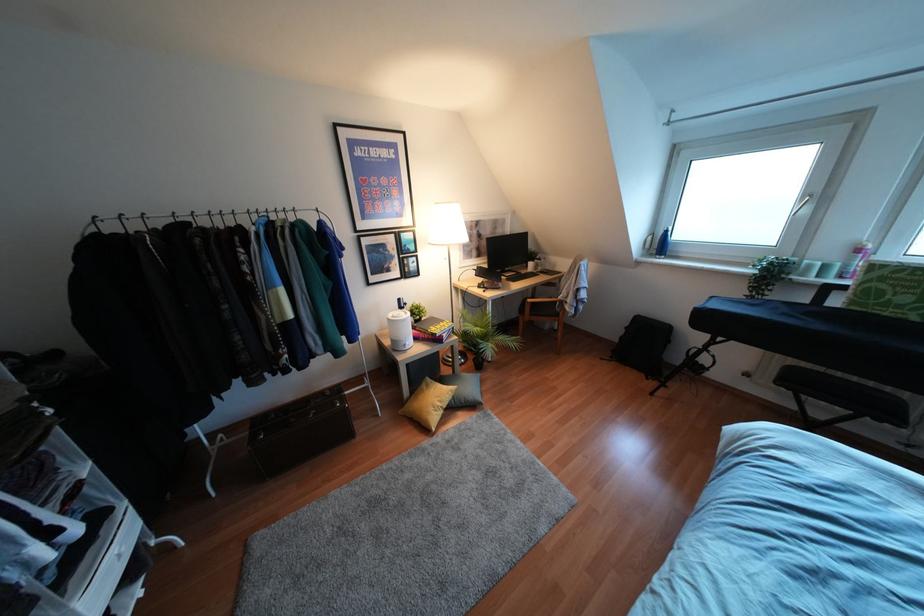
Identify the location of window handle. (801, 204).